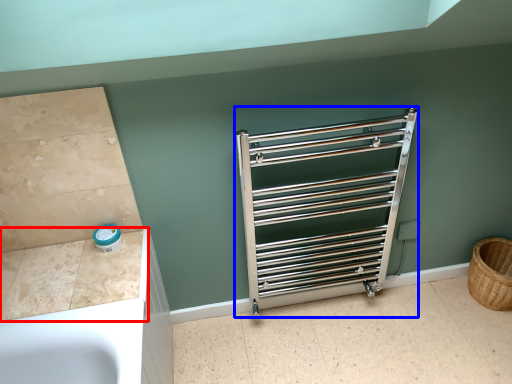
Question: Which point is further to the camera, counter top (highlighted by a red box) or cage (highlighted by a blue box)?

Choices:
 (A) counter top
 (B) cage

Answer: (B)